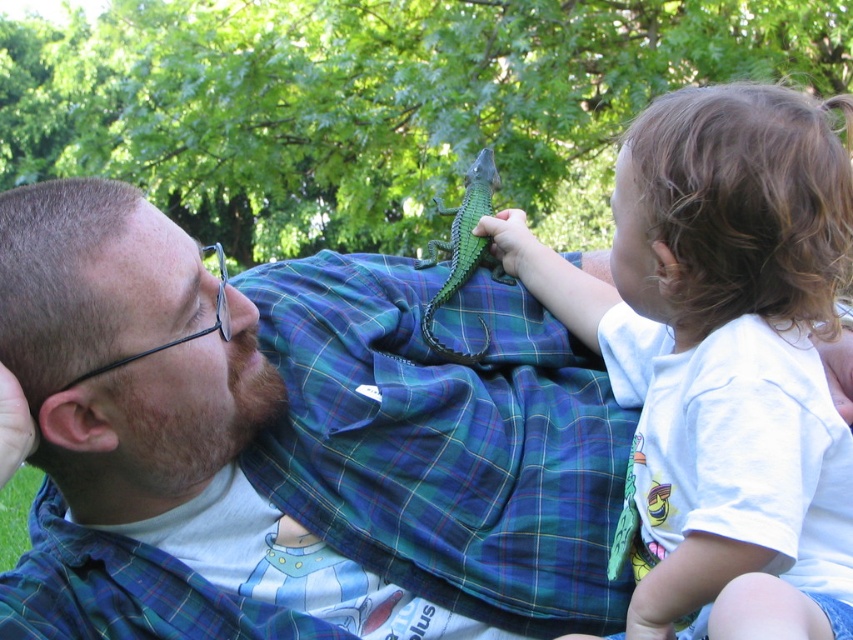
You are standing in the park and see two points in the image. Which point is closer to you, point (612, 364) or point (437, 243)?

Point (612, 364) is closer to the viewer than point (437, 243).

You are a parent observing your child playing with the green matte toy lizard at upper center and the green matte toy lizard at center. Which toy lizard is taller?

The green matte toy lizard at upper center is much taller than the green matte toy lizard at center.

What is located at the coordinates point (292,444)?

The green matte toy lizard at upper center is located at point (292,444).